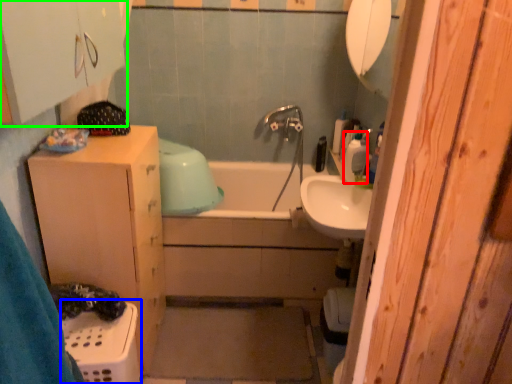
Question: Estimate the real-world distances between objects in this image. Which object is closer to soap dispenser (highlighted by a red box), laundry basket (highlighted by a blue box) or cabinetry (highlighted by a green box)?

Choices:
 (A) laundry basket
 (B) cabinetry

Answer: (B)